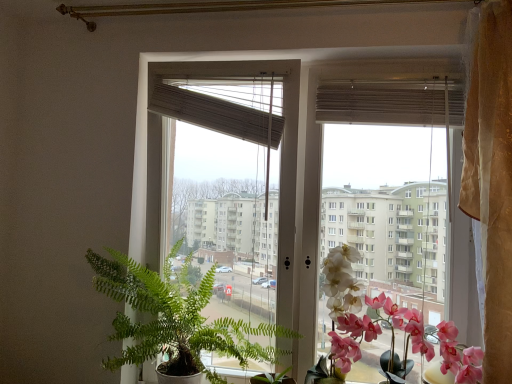
Question: Does beige textured curtain at right come behind pink silk orchid at right, positioned as the 2th flower in left-to-right order?

Choices:
 (A) yes
 (B) no

Answer: (B)

Question: Is beige textured curtain at right with pink silk orchid at right, the 1th flower viewed from the right?

Choices:
 (A) no
 (B) yes

Answer: (A)

Question: Can you confirm if beige textured curtain at right is wider than pink silk orchid at right, the 1th flower viewed from the right?

Choices:
 (A) yes
 (B) no

Answer: (A)

Question: Is pink silk orchid at right, positioned as the 2th flower in left-to-right order, a part of beige textured curtain at right?

Choices:
 (A) no
 (B) yes

Answer: (A)

Question: From a real-world perspective, is beige textured curtain at right physically below pink silk orchid at right, the 1th flower viewed from the right?

Choices:
 (A) no
 (B) yes

Answer: (A)

Question: Does beige textured curtain at right turn towards pink silk orchid at right, positioned as the 2th flower in left-to-right order?

Choices:
 (A) yes
 (B) no

Answer: (B)

Question: Is beige woven blind at upper center, the 2th blind when ordered from right to left, touching pink silk orchid at right, positioned as the 2th flower in left-to-right order?

Choices:
 (A) yes
 (B) no

Answer: (B)

Question: From a real-world perspective, is beige woven blind at upper center, placed as the first blind when sorted from left to right, on top of pink silk orchid at right, the 1th flower viewed from the right?

Choices:
 (A) no
 (B) yes

Answer: (B)

Question: Is beige woven blind at upper center, placed as the first blind when sorted from left to right, outside pink silk orchid at right, positioned as the 2th flower in left-to-right order?

Choices:
 (A) no
 (B) yes

Answer: (B)

Question: Considering the relative sizes of beige woven blind at upper center, placed as the first blind when sorted from left to right, and pink silk orchid at right, positioned as the 2th flower in left-to-right order, in the image provided, is beige woven blind at upper center, placed as the first blind when sorted from left to right, taller than pink silk orchid at right, positioned as the 2th flower in left-to-right order,?

Choices:
 (A) yes
 (B) no

Answer: (B)

Question: Considering the relative sizes of beige woven blind at upper center, placed as the first blind when sorted from left to right, and pink silk orchid at right, the 1th flower viewed from the right, in the image provided, is beige woven blind at upper center, placed as the first blind when sorted from left to right, wider than pink silk orchid at right, the 1th flower viewed from the right,?

Choices:
 (A) no
 (B) yes

Answer: (A)

Question: Is beige woven blind at upper center, placed as the first blind when sorted from left to right, surrounding pink silk orchid at right, the 1th flower viewed from the right?

Choices:
 (A) no
 (B) yes

Answer: (A)

Question: Is beige woven blind at upper center, placed as the first blind when sorted from left to right, positioned far away from matte brown blind at upper center, which appears as the first blind when viewed from the right?

Choices:
 (A) yes
 (B) no

Answer: (B)